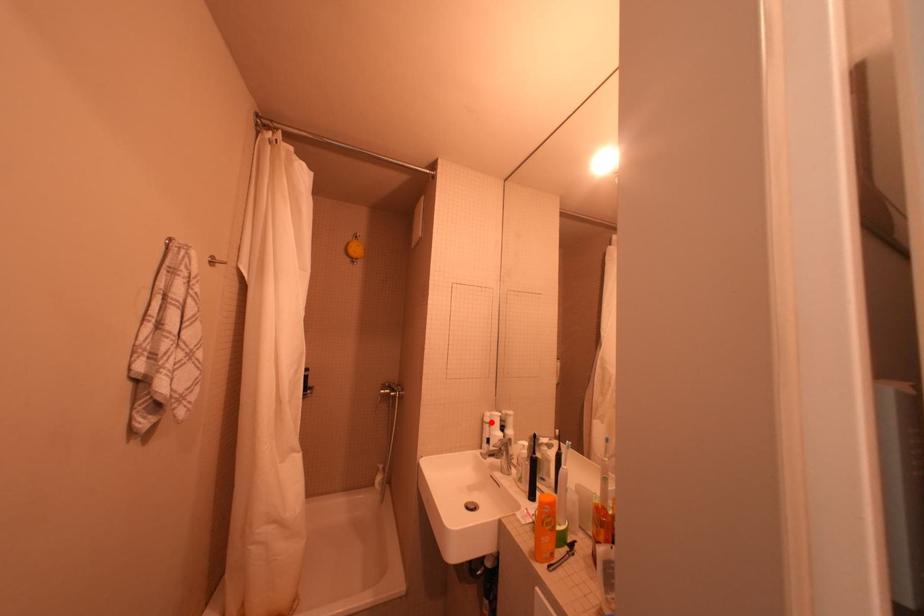
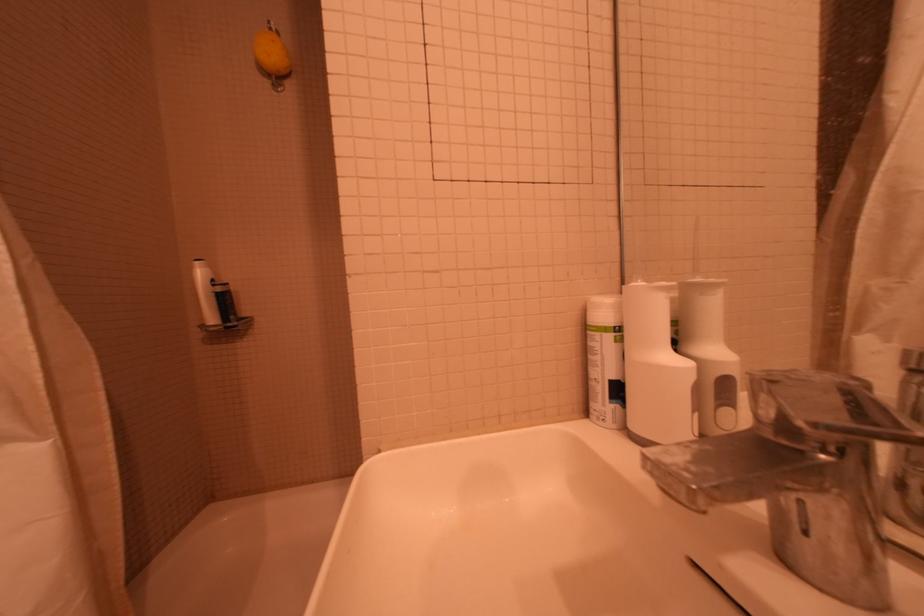
Locate, in the second image, the point that corresponds to the highlighted location in the first image.

(593, 330)